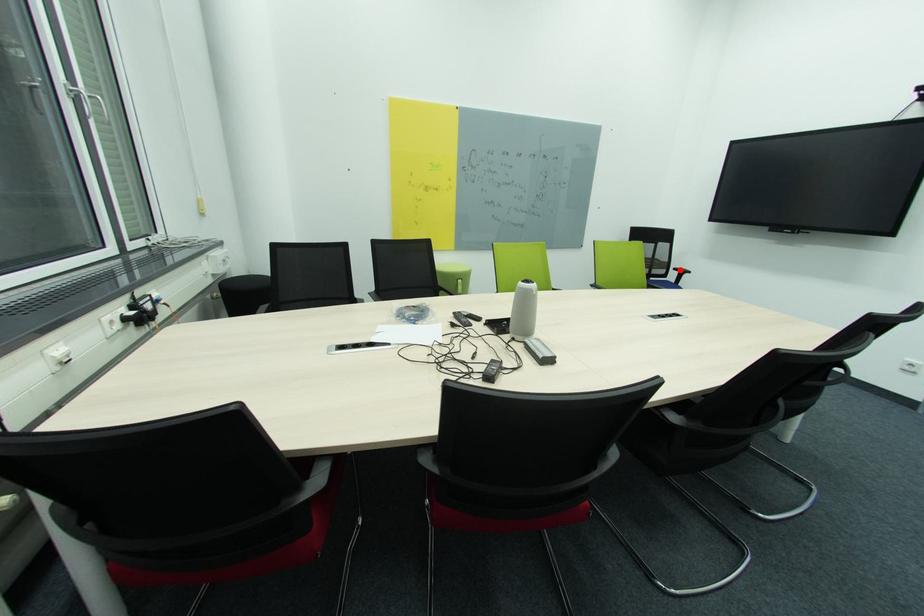
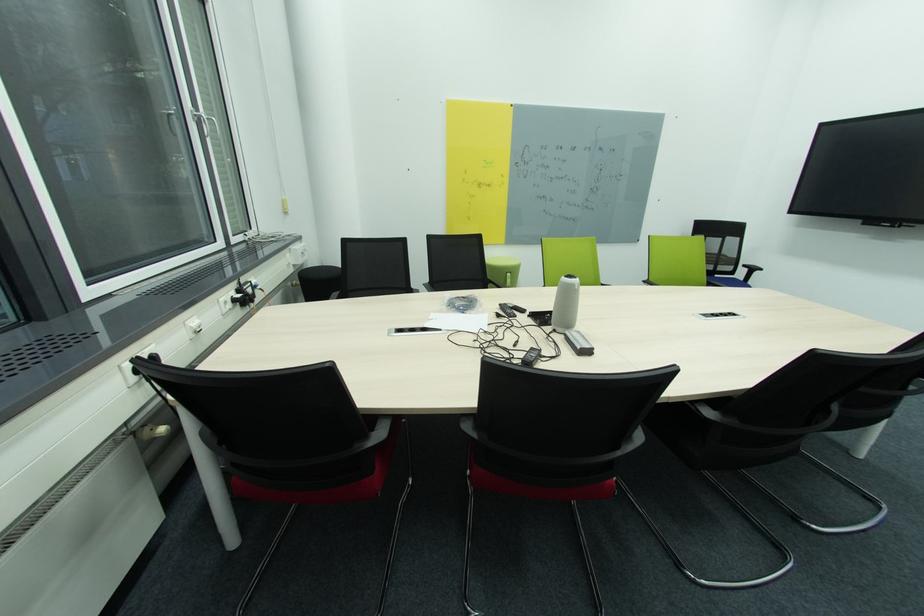
Locate, in the second image, the point that corresponds to the highlighted location in the first image.

(749, 267)